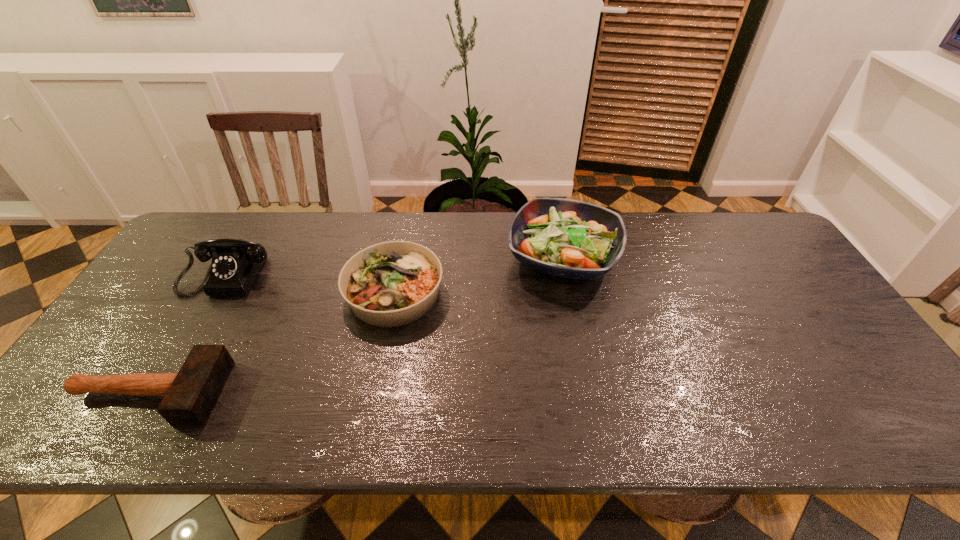
You are a GUI agent. You are given a task and a screenshot of the screen. Output one action in this format:
    pyautogui.click(x=<x>, y=<y>)
    Task: Click on the free spot located on the hammer head face of the mallet
    
    Given the screenshot: What is the action you would take?
    click(x=381, y=393)

The width and height of the screenshot is (960, 540). I want to click on salad plate at the far edge, so click(568, 238).

At what (x,y) coordinates should I click in order to perform the action: click on telephone positioned at the far edge. Please return your answer as a coordinate pair (x, y). Looking at the image, I should click on (236, 263).

At what (x,y) coordinates should I click in order to perform the action: click on object located at the near edge. Please return your answer as a coordinate pair (x, y). Looking at the image, I should click on (189, 396).

Identify the location of telephone located in the left edge section of the desktop. (236, 263).

Identify the location of mallet that is at the left edge. Image resolution: width=960 pixels, height=540 pixels. (189, 396).

What are the coordinates of `object that is at the far left corner` in the screenshot? It's located at (236, 263).

You are a GUI agent. You are given a task and a screenshot of the screen. Output one action in this format:
    pyautogui.click(x=<x>, y=<y>)
    Task: Click on the object at the near left corner
    Image resolution: width=960 pixels, height=540 pixels.
    Given the screenshot: What is the action you would take?
    pyautogui.click(x=189, y=396)

Identify the location of free location at the far edge of the desktop. (329, 240).

Locate an element on the screen. vacant area at the near edge is located at coordinates (359, 419).